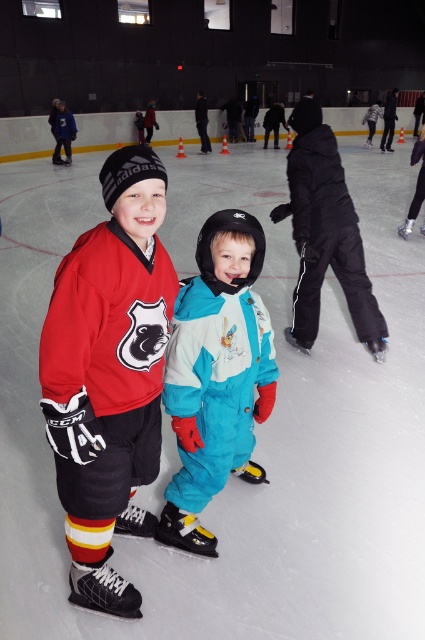
Question: Among these objects, which one is nearest to the camera?

Choices:
 (A) black matte snowsuit at center
 (B) matte red hockey jersey at center
 (C) teal snowsuit at center

Answer: (B)

Question: Which point is closer to the camera?

Choices:
 (A) (198, 262)
 (B) (95, 342)
 (C) (311, 308)

Answer: (B)

Question: Does teal snowsuit at center have a smaller size compared to black matte snowsuit at center?

Choices:
 (A) yes
 (B) no

Answer: (A)

Question: Can you confirm if teal snowsuit at center is positioned above black matte snowsuit at center?

Choices:
 (A) no
 (B) yes

Answer: (A)

Question: Estimate the real-world distances between objects in this image. Which object is farther from the matte red hockey jersey at center?

Choices:
 (A) black matte snowsuit at center
 (B) teal snowsuit at center

Answer: (A)

Question: Is matte red hockey jersey at center above black matte snowsuit at center?

Choices:
 (A) yes
 (B) no

Answer: (B)